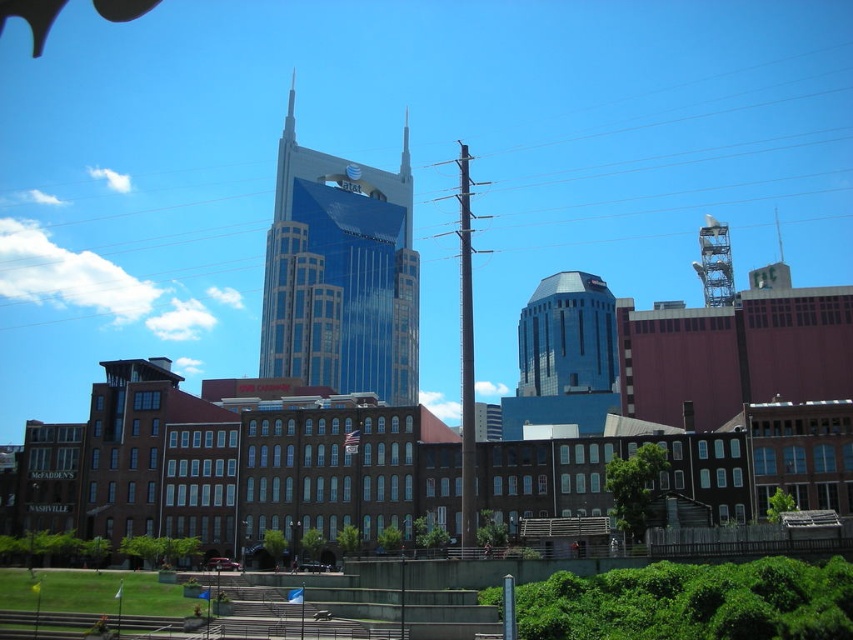
Question: Is metallic lattice tower at upper right above gold metallic spire at upper center?

Choices:
 (A) no
 (B) yes

Answer: (A)

Question: Which point is closer to the camera taking this photo?

Choices:
 (A) 773,221
 (B) 408,173
 (C) 410,394
 (D) 723,232

Answer: (D)

Question: Is gold metallic spire at upper center to the left of shiny glass spire at center from the viewer's perspective?

Choices:
 (A) yes
 (B) no

Answer: (A)

Question: Does metallic lattice tower at upper right appear over shiny glass spire at center?

Choices:
 (A) yes
 (B) no

Answer: (B)

Question: Which object is farther from the camera taking this photo?

Choices:
 (A) gold metallic spire at upper center
 (B) blue glassy skyscraper at center

Answer: (A)

Question: Which object is the farthest from the shiny silver spire at upper right?

Choices:
 (A) blue glassy skyscraper at center
 (B) gold metallic spire at upper center

Answer: (B)